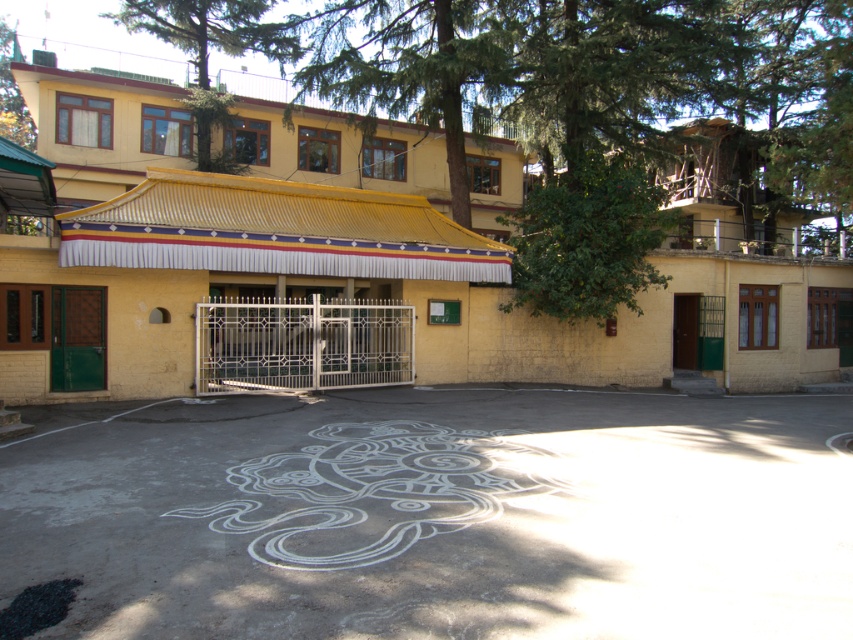
You are standing in front of the building and want to take a photo of both the white chalk drawing at center and the green wooden door at left. Since you can only focus on one object at a time, which one should you focus on first to ensure it appears larger in the photo?

The white chalk drawing at center is not as tall as the green wooden door at left, so you should focus on the green wooden door at left first to ensure it appears larger in the photo.

You are a visitor approaching the building and see the green wooden door at left and the brown wooden door at center. Which door is closer to the ground?

The green wooden door at left is below brown wooden door at center, so the green wooden door at left is closer to the ground.